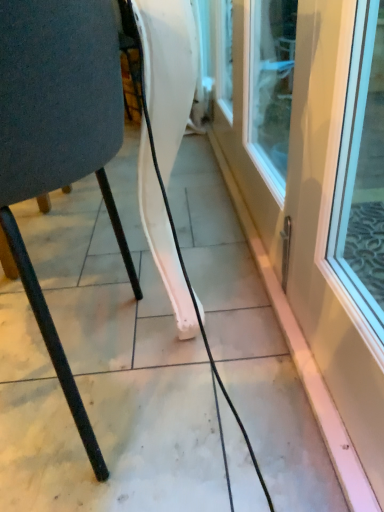
Question: From a real-world perspective, is white glossy door at right positioned under matte black chair at left based on gravity?

Choices:
 (A) no
 (B) yes

Answer: (B)

Question: Does white glossy door at right have a smaller size compared to matte black chair at left?

Choices:
 (A) yes
 (B) no

Answer: (A)

Question: Is white glossy door at right further to camera compared to matte black chair at left?

Choices:
 (A) yes
 (B) no

Answer: (B)

Question: From a real-world perspective, is white glossy door at right physically above matte black chair at left?

Choices:
 (A) yes
 (B) no

Answer: (B)

Question: Does white glossy door at right have a lesser width compared to matte black chair at left?

Choices:
 (A) no
 (B) yes

Answer: (B)

Question: From the image's perspective, would you say white glossy door at right is shown under matte black chair at left?

Choices:
 (A) yes
 (B) no

Answer: (B)

Question: From a real-world perspective, is matte black chair at left positioned over white glossy door at right based on gravity?

Choices:
 (A) no
 (B) yes

Answer: (B)

Question: Does matte black chair at left have a greater height compared to white glossy door at right?

Choices:
 (A) yes
 (B) no

Answer: (A)

Question: Is matte black chair at left touching white glossy door at right?

Choices:
 (A) yes
 (B) no

Answer: (B)

Question: Is matte black chair at left wider than white glossy door at right?

Choices:
 (A) yes
 (B) no

Answer: (A)

Question: From the image's perspective, does matte black chair at left appear lower than white glossy door at right?

Choices:
 (A) no
 (B) yes

Answer: (B)

Question: Would you say matte black chair at left is outside white glossy door at right?

Choices:
 (A) yes
 (B) no

Answer: (A)

Question: Is white glossy door at right in front of or behind matte black chair at left in the image?

Choices:
 (A) front
 (B) behind

Answer: (A)